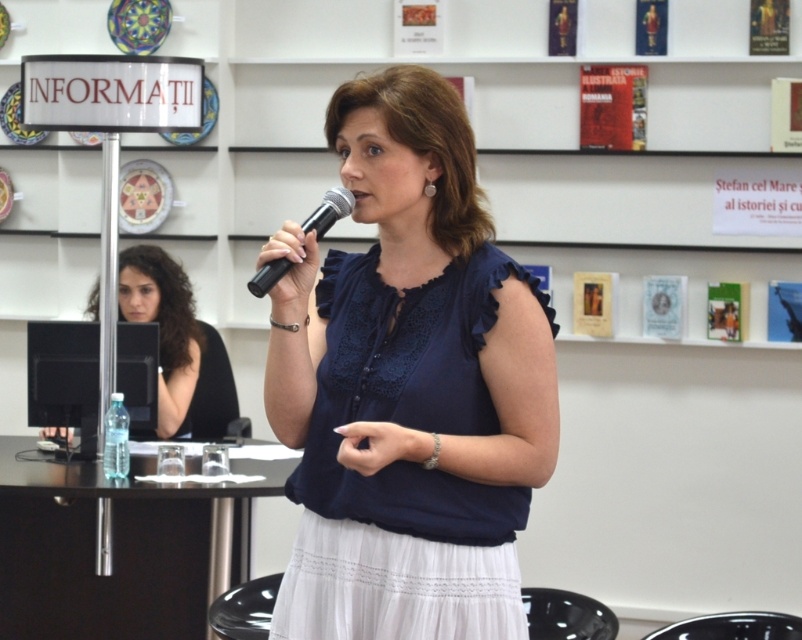
Who is positioned more to the left, matte blue blouse at center or black plastic microphone at center?

black plastic microphone at center is more to the left.

Is matte blue blouse at center further to camera compared to black plastic microphone at center?

Yes, it is behind black plastic microphone at center.

Locate an element on the screen. matte blue blouse at center is located at coordinates (408, 385).

Does black fabric shirt at center have a larger size compared to black plastic microphone at center?

Correct, black fabric shirt at center is larger in size than black plastic microphone at center.

Between black fabric shirt at center and black plastic microphone at center, which one has less height?

black plastic microphone at center

Is point (189, 330) behind point (338, 205)?

Yes.

In order to click on black fabric shirt at center in this screenshot , I will do `click(163, 326)`.

Does matte blue blouse at center appear on the left side of black fabric shirt at center?

No, matte blue blouse at center is not to the left of black fabric shirt at center.

Looking at this image, does matte blue blouse at center appear over black fabric shirt at center?

Incorrect, matte blue blouse at center is not positioned above black fabric shirt at center.

Where is `matte blue blouse at center`? This screenshot has height=640, width=802. matte blue blouse at center is located at coordinates (408, 385).